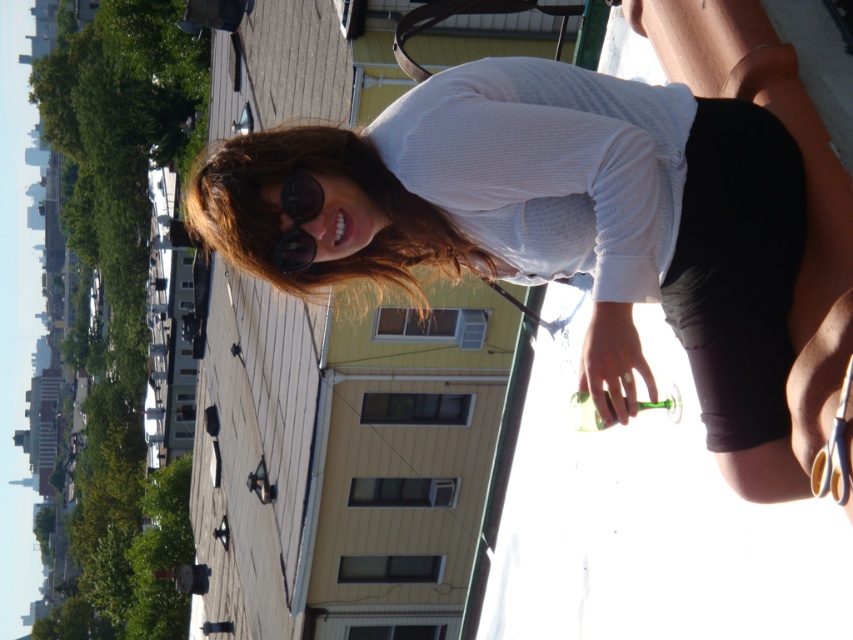
Question: Is white textured shirt at upper center behind transparent dark blue sunglasses at upper center?

Choices:
 (A) yes
 (B) no

Answer: (B)

Question: Which of the following is the farthest from the observer?

Choices:
 (A) white textured shirt at upper center
 (B) transparent dark blue sunglasses at upper center

Answer: (B)

Question: Considering the relative positions of white textured shirt at upper center and transparent dark blue sunglasses at upper center in the image provided, where is white textured shirt at upper center located with respect to transparent dark blue sunglasses at upper center?

Choices:
 (A) left
 (B) right

Answer: (B)

Question: Is white textured shirt at upper center to the left of transparent dark blue sunglasses at upper center from the viewer's perspective?

Choices:
 (A) no
 (B) yes

Answer: (A)